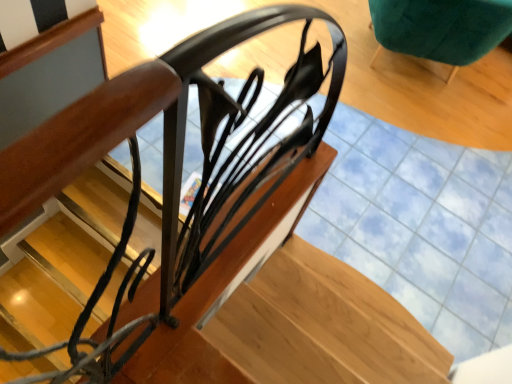
Question: Does velvet green armchair at upper right have a larger size compared to glossy metal stairs at center?

Choices:
 (A) no
 (B) yes

Answer: (A)

Question: Would you say glossy metal stairs at center is part of velvet green armchair at upper right's contents?

Choices:
 (A) yes
 (B) no

Answer: (B)

Question: Is velvet green armchair at upper right next to glossy metal stairs at center?

Choices:
 (A) no
 (B) yes

Answer: (A)

Question: Can you confirm if velvet green armchair at upper right is shorter than glossy metal stairs at center?

Choices:
 (A) yes
 (B) no

Answer: (B)

Question: Can you confirm if velvet green armchair at upper right is smaller than glossy metal stairs at center?

Choices:
 (A) yes
 (B) no

Answer: (A)

Question: Considering the relative positions of velvet green armchair at upper right and glossy metal stairs at center in the image provided, is velvet green armchair at upper right to the left of glossy metal stairs at center from the viewer's perspective?

Choices:
 (A) yes
 (B) no

Answer: (B)

Question: Is glossy metal stairs at center at the left side of velvet green armchair at upper right?

Choices:
 (A) yes
 (B) no

Answer: (A)

Question: Is glossy metal stairs at center bigger than velvet green armchair at upper right?

Choices:
 (A) no
 (B) yes

Answer: (B)

Question: From the image's perspective, would you say glossy metal stairs at center is shown under velvet green armchair at upper right?

Choices:
 (A) no
 (B) yes

Answer: (B)

Question: Is glossy metal stairs at center oriented towards velvet green armchair at upper right?

Choices:
 (A) no
 (B) yes

Answer: (A)

Question: Does glossy metal stairs at center lie in front of velvet green armchair at upper right?

Choices:
 (A) no
 (B) yes

Answer: (B)

Question: Is glossy metal stairs at center thinner than velvet green armchair at upper right?

Choices:
 (A) no
 (B) yes

Answer: (A)

Question: Is glossy metal stairs at center wider or thinner than velvet green armchair at upper right?

Choices:
 (A) thin
 (B) wide

Answer: (B)